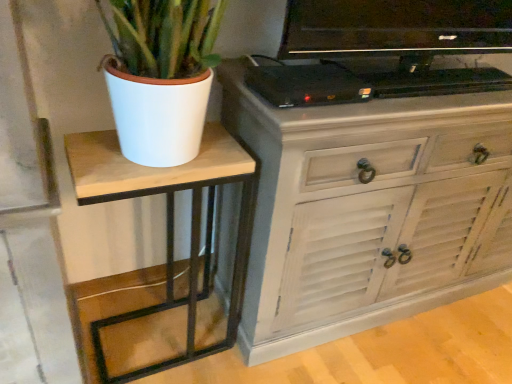
Find the location of a particular element. vacant space underneath black glossy television at upper center (from a real-world perspective) is located at coordinates (426, 79).